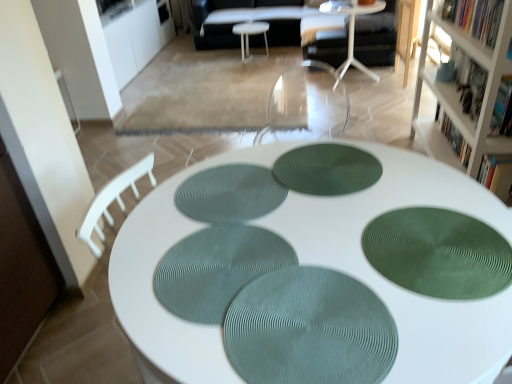
Find the location of a particular element. The image size is (512, 384). vacant space underneath green textured placemat at center (from a real-world perspective) is located at coordinates (306, 327).